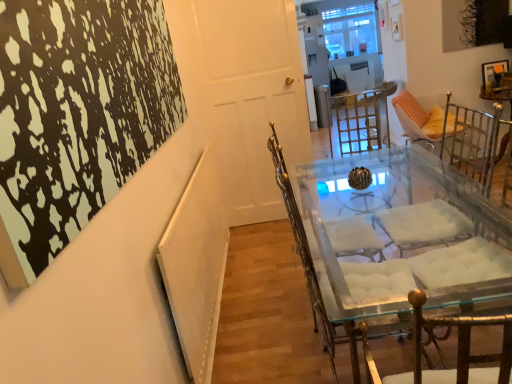
Question: Considering the positions of clear glass table at center and clear glass chair at center in the image, is clear glass table at center taller or shorter than clear glass chair at center?

Choices:
 (A) tall
 (B) short

Answer: (B)

Question: Considering the positions of point (x=342, y=160) and point (x=346, y=331), is point (x=342, y=160) closer or farther from the camera than point (x=346, y=331)?

Choices:
 (A) farther
 (B) closer

Answer: (A)

Question: Considering the real-world distances, which object is farthest from the clear glass table at center?

Choices:
 (A) clear glass chair at center
 (B) white glossy door at center

Answer: (B)

Question: Which object is positioned farthest from the clear glass chair at center?

Choices:
 (A) white glossy door at center
 (B) clear glass table at center

Answer: (A)